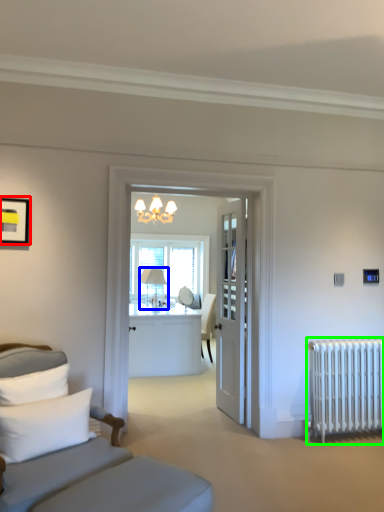
Question: Considering the real-world distances, which object is closest to picture frame (highlighted by a red box)? table lamp (highlighted by a blue box) or radiator (highlighted by a green box).

Choices:
 (A) table lamp
 (B) radiator

Answer: (A)